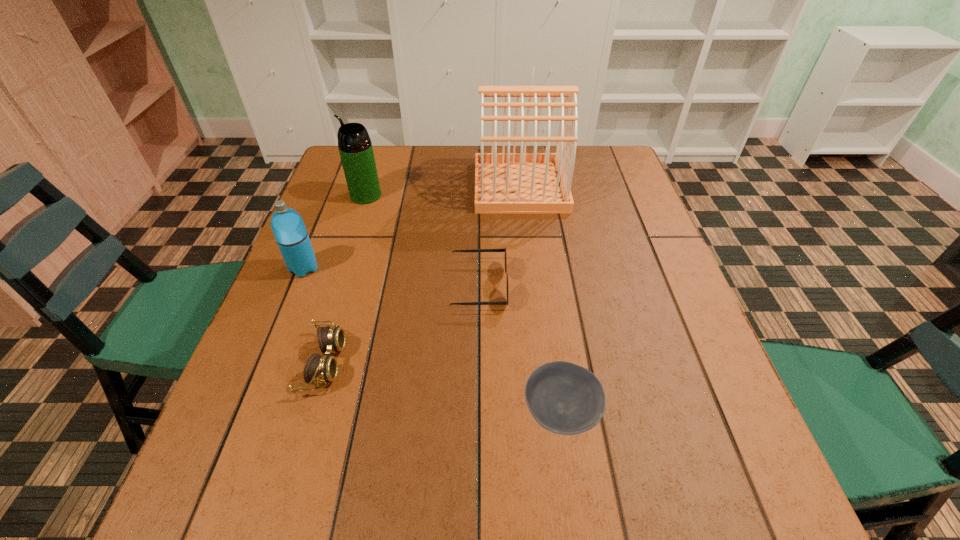
Image resolution: width=960 pixels, height=540 pixels. In order to click on birdcage in this screenshot , I will do `click(508, 182)`.

Image resolution: width=960 pixels, height=540 pixels. Find the location of `the fifth shortest object`. the fifth shortest object is located at coordinates (355, 147).

Find the location of a particular element. the taller thermos bottle is located at coordinates (355, 147).

The height and width of the screenshot is (540, 960). What are the coordinates of `the leftmost object` in the screenshot? It's located at (289, 230).

In order to click on the shorter thermos bottle in this screenshot , I will do `click(289, 230)`.

The image size is (960, 540). I want to click on sunglasses, so click(503, 249).

Image resolution: width=960 pixels, height=540 pixels. In order to click on goggles in this screenshot , I will do `click(318, 369)`.

Identify the location of bowl. The height and width of the screenshot is (540, 960). (564, 398).

Image resolution: width=960 pixels, height=540 pixels. Find the location of `vacant area located 0.360m with an open door on the tallest object`. vacant area located 0.360m with an open door on the tallest object is located at coordinates (352, 186).

The image size is (960, 540). What are the coordinates of `free space located 0.100m with an open door on the tallest object` in the screenshot? It's located at (441, 186).